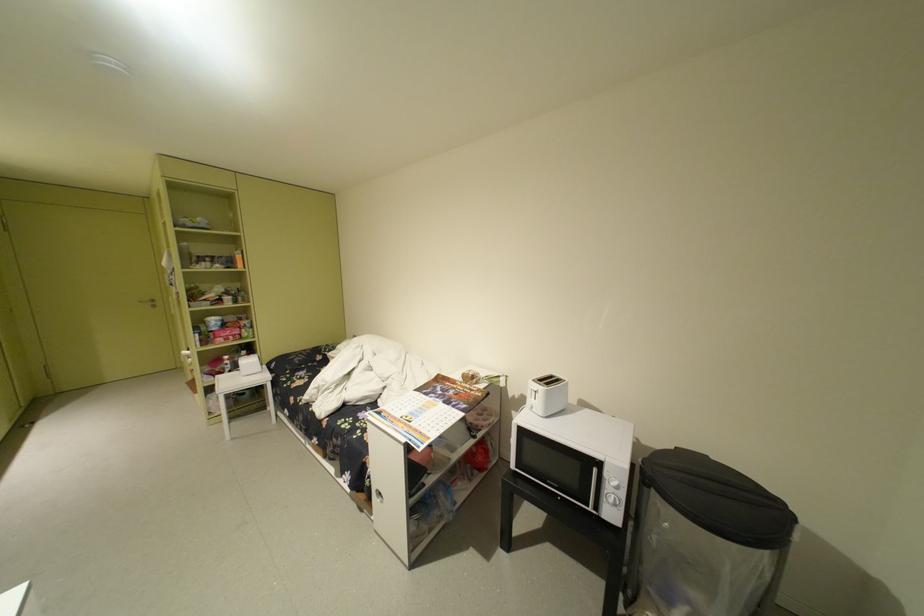
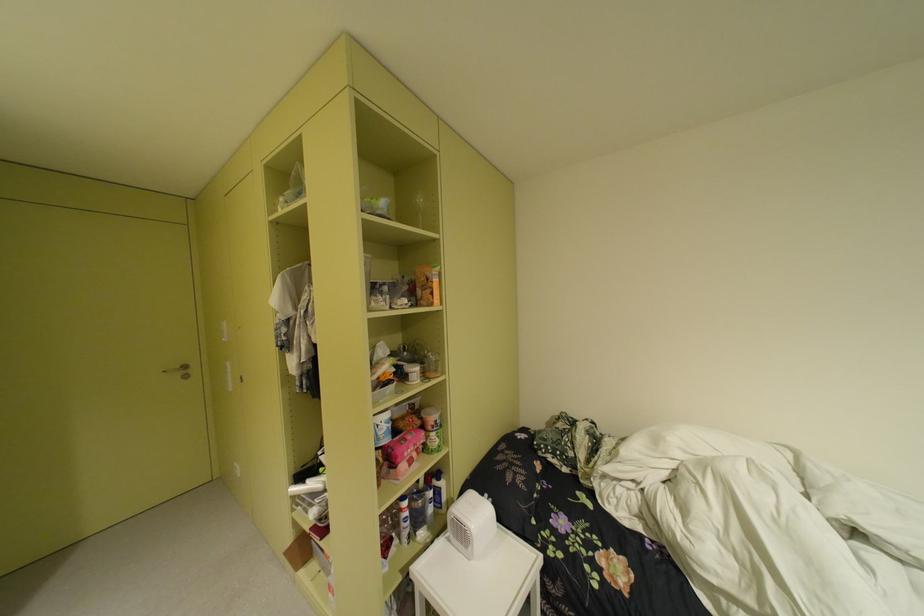
Where in the second image is the point corresponding to [151,302] from the first image?

(175, 371)